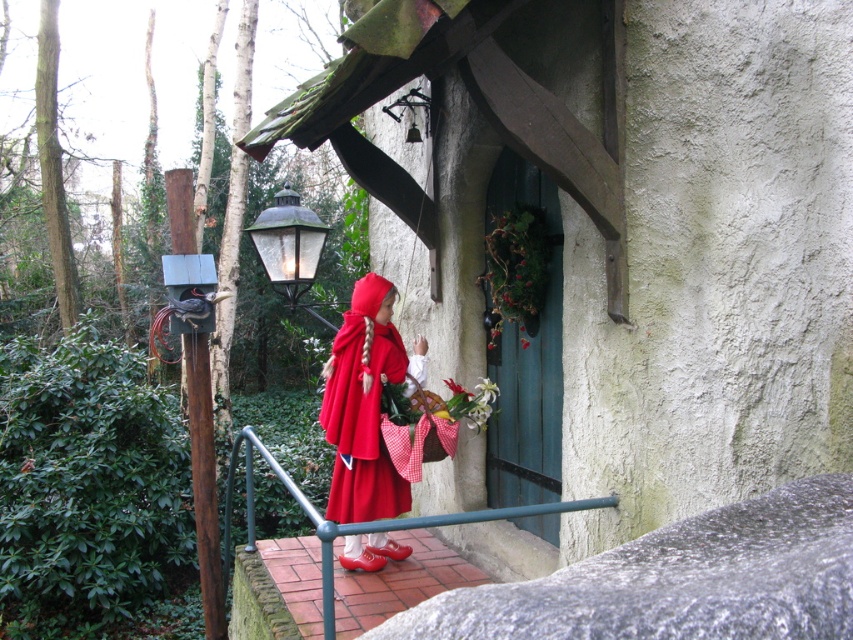
Does matte red cape at center have a greater width compared to white matte flower at center?

Yes.

Does matte red cape at center appear under white matte flower at center?

No.

Image resolution: width=853 pixels, height=640 pixels. What do you see at coordinates (363, 406) in the screenshot?
I see `matte red cape at center` at bounding box center [363, 406].

You are a GUI agent. You are given a task and a screenshot of the screen. Output one action in this format:
    pyautogui.click(x=<x>, y=<y>)
    Task: Click on the matte red cape at center
    The width and height of the screenshot is (853, 640).
    Given the screenshot: What is the action you would take?
    pyautogui.click(x=363, y=406)